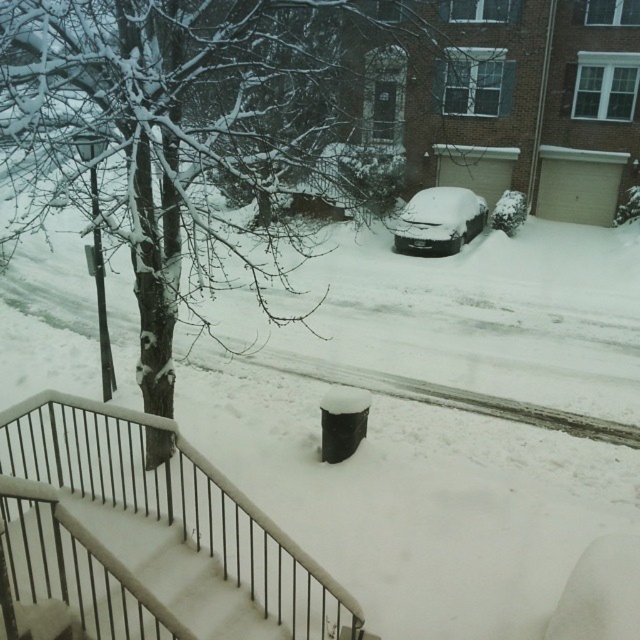
Question: Can you confirm if white matte stair at lower left is bigger than snow-covered car at center?

Choices:
 (A) no
 (B) yes

Answer: (A)

Question: Considering the relative positions of snow-covered tree at center and snow-covered car at center in the image provided, where is snow-covered tree at center located with respect to snow-covered car at center?

Choices:
 (A) right
 (B) left

Answer: (B)

Question: Can you confirm if snow-covered tree at center is positioned to the right of snow-covered car at center?

Choices:
 (A) yes
 (B) no

Answer: (B)

Question: Which object is positioned farthest from the snow-covered tree at center?

Choices:
 (A) white matte stair at lower left
 (B) metallic gray balustrade at lower center

Answer: (A)

Question: Estimate the real-world distances between objects in this image. Which object is closer to the snow-covered car at center?

Choices:
 (A) snow-covered tree at center
 (B) white matte stair at lower left
 (C) metallic gray balustrade at lower center

Answer: (A)

Question: Which object appears closest to the camera in this image?

Choices:
 (A) metallic gray balustrade at lower center
 (B) white matte stair at lower left
 (C) snow-covered tree at center
 (D) snow-covered car at center

Answer: (A)